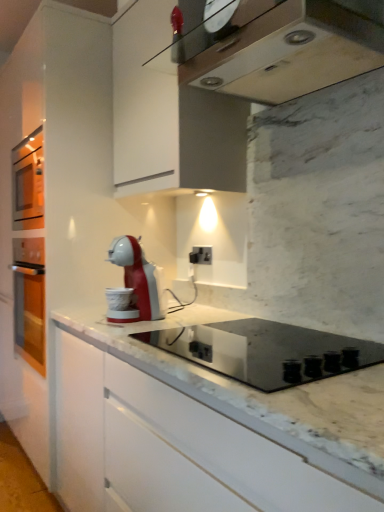
Question: Is the depth of black plastic electric outlet at center greater than that of black glass cooktop at center?

Choices:
 (A) no
 (B) yes

Answer: (B)

Question: Considering the relative sizes of black plastic electric outlet at center and black glass cooktop at center in the image provided, is black plastic electric outlet at center thinner than black glass cooktop at center?

Choices:
 (A) yes
 (B) no

Answer: (A)

Question: Does black plastic electric outlet at center turn towards black glass cooktop at center?

Choices:
 (A) yes
 (B) no

Answer: (B)

Question: From a real-world perspective, does black plastic electric outlet at center sit lower than black glass cooktop at center?

Choices:
 (A) yes
 (B) no

Answer: (B)

Question: From a real-world perspective, is black plastic electric outlet at center over black glass cooktop at center?

Choices:
 (A) no
 (B) yes

Answer: (B)

Question: Considering the relative sizes of black plastic electric outlet at center and black glass cooktop at center in the image provided, is black plastic electric outlet at center smaller than black glass cooktop at center?

Choices:
 (A) yes
 (B) no

Answer: (A)

Question: Is the position of metallic silver range hood at upper center less distant than that of black plastic electric outlet at center?

Choices:
 (A) no
 (B) yes

Answer: (B)

Question: Can you confirm if metallic silver range hood at upper center is shorter than black plastic electric outlet at center?

Choices:
 (A) yes
 (B) no

Answer: (A)

Question: Is metallic silver range hood at upper center wider than black plastic electric outlet at center?

Choices:
 (A) no
 (B) yes

Answer: (B)

Question: Can you confirm if metallic silver range hood at upper center is positioned to the right of black plastic electric outlet at center?

Choices:
 (A) yes
 (B) no

Answer: (A)

Question: Is metallic silver range hood at upper center further to camera compared to black plastic electric outlet at center?

Choices:
 (A) no
 (B) yes

Answer: (A)

Question: Is metallic silver range hood at upper center directly adjacent to black plastic electric outlet at center?

Choices:
 (A) no
 (B) yes

Answer: (A)

Question: From a real-world perspective, is black glass cooktop at center over black plastic electric outlet at center?

Choices:
 (A) yes
 (B) no

Answer: (B)